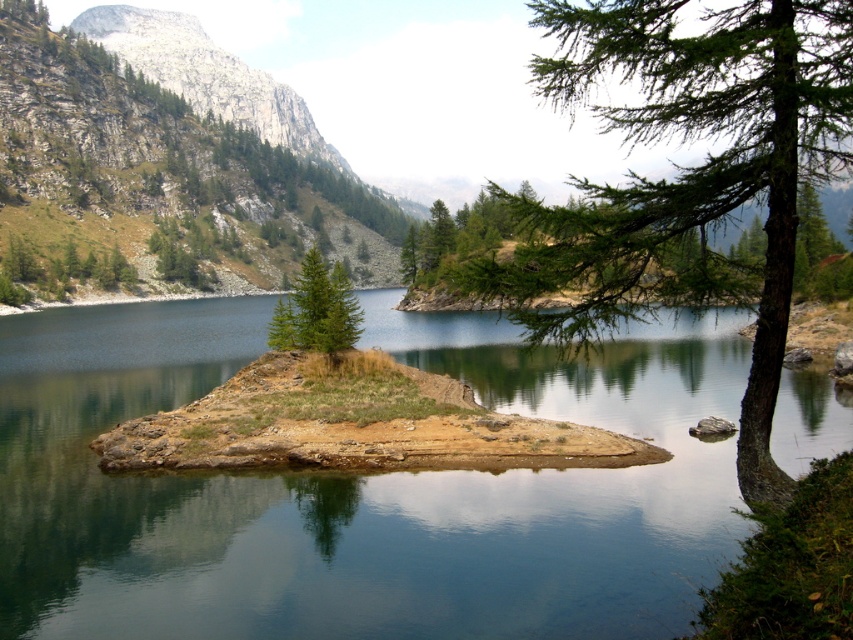
You are a hiker planning to cross from the mainland to the green grassy island at center. You notice the rocky gray mountain at upper left in the distance. Which direction should you head relative to the mountain to reach the island?

The green grassy island at center is positioned on the right side of rocky gray mountain at upper left, so you should head to the right relative to the mountain to reach the island.

You are a hiker planning to cross from the mainland to the green grassy island at center. The rocky gray mountain at upper left is blocking your path. Can you see the island from your current position?

The green grassy island at center has a lesser height compared to rocky gray mountain at upper left, so the mountain might block your view. However, since the island is at the center and the mountain is at the upper left, you might still see the island depending on your exact position. The description does not specify visibility obstruction beyond height differences.